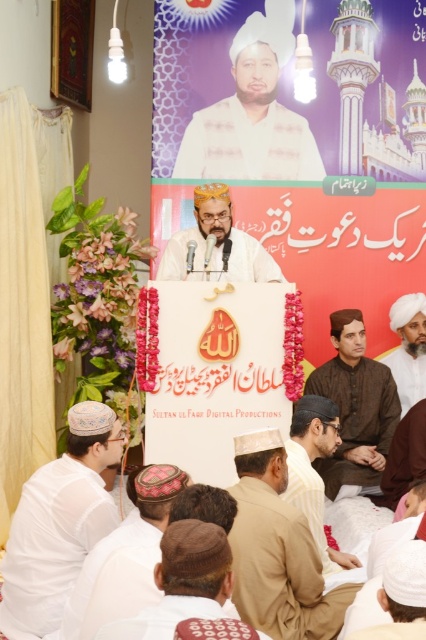
You are an attendee at this event and want to move from your current position to a point closer to the speaker. Which of the two points, point (138, 515) or point (397, 611), should you move towards?

You should move towards point (138, 515) because it is closer to the speaker than point (397, 611).

In the scene shown: You are attending a cultural event and notice a white cotton cap at lower left. What are its exact coordinates on the image?

The white cotton cap at lower left is located at coordinates point (60,522).

You are an attendee at this event and want to compare the height of the brown textured hat at lower center and the light brown fabric cap at center. Which one is taller?

The light brown fabric cap at center is taller than the brown textured hat at lower center.